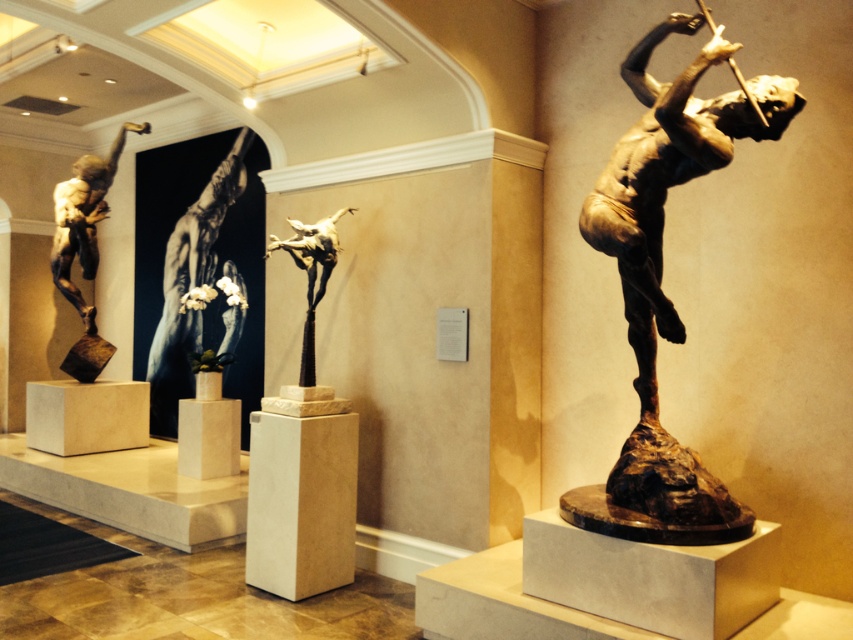
Question: Among these objects, which one is farthest from the camera?

Choices:
 (A) bronze statue at center
 (B) bronze statue at left

Answer: (B)

Question: Observing the image, what is the correct spatial positioning of matte bronze statue at center in reference to bronze statue at left?

Choices:
 (A) below
 (B) above

Answer: (A)

Question: Among these points, which one is nearest to the camera?

Choices:
 (A) (322, 582)
 (B) (698, 58)
 (C) (99, 182)

Answer: (B)

Question: In this image, where is white marble pedestal at center located relative to bronze statue at center?

Choices:
 (A) above
 (B) below

Answer: (B)

Question: Observing the image, what is the correct spatial positioning of bronze statue at right in reference to white marble pedestal at center?

Choices:
 (A) left
 (B) right

Answer: (B)

Question: Which point is farther from the camera taking this photo?

Choices:
 (A) (264, 440)
 (B) (86, 195)

Answer: (B)